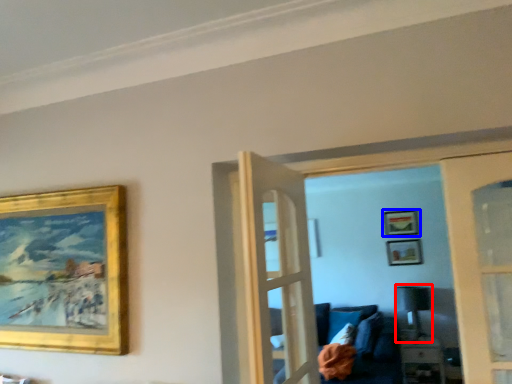
Question: Among these objects, which one is nearest to the camera, lamp (highlighted by a red box) or picture frame (highlighted by a blue box)?

Choices:
 (A) lamp
 (B) picture frame

Answer: (A)